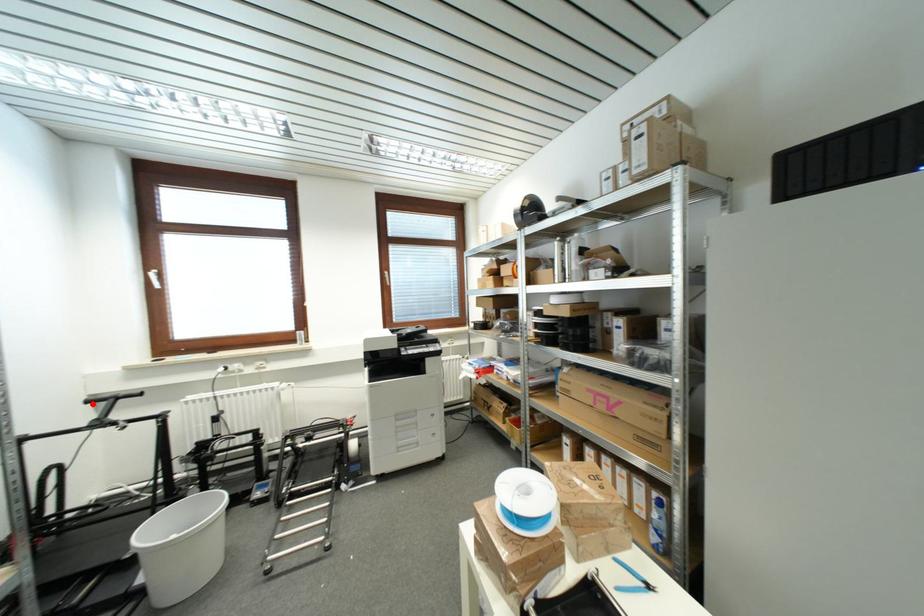
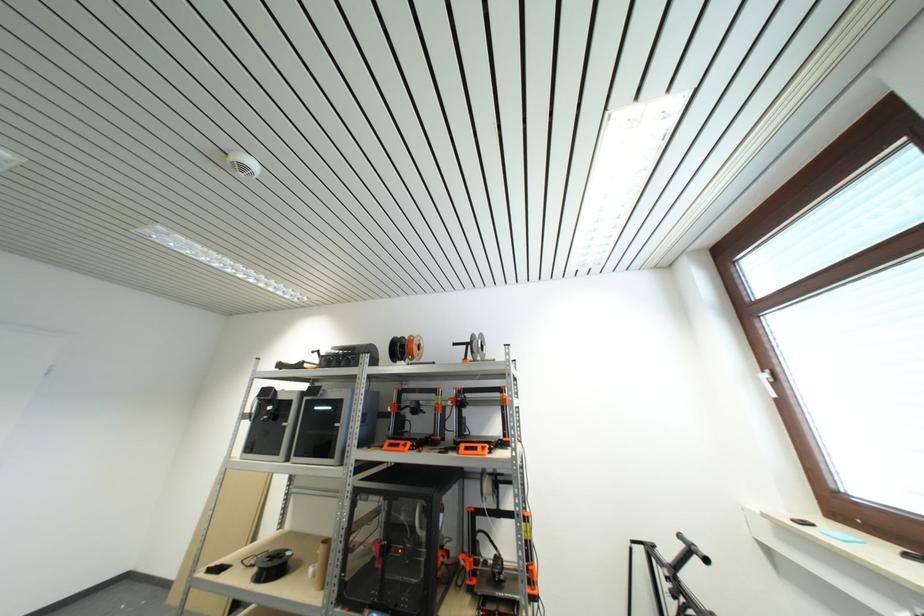
Locate, in the second image, the point that corresponds to the highlighted location in the first image.

(685, 540)